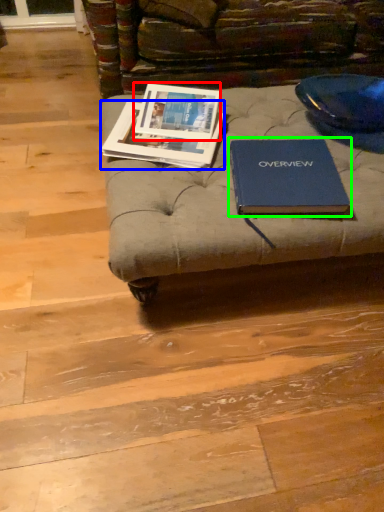
Question: Which object is positioned farthest from book cover (highlighted by a red box)? Select from book (highlighted by a blue box) and book (highlighted by a green box).

Choices:
 (A) book
 (B) book

Answer: (B)